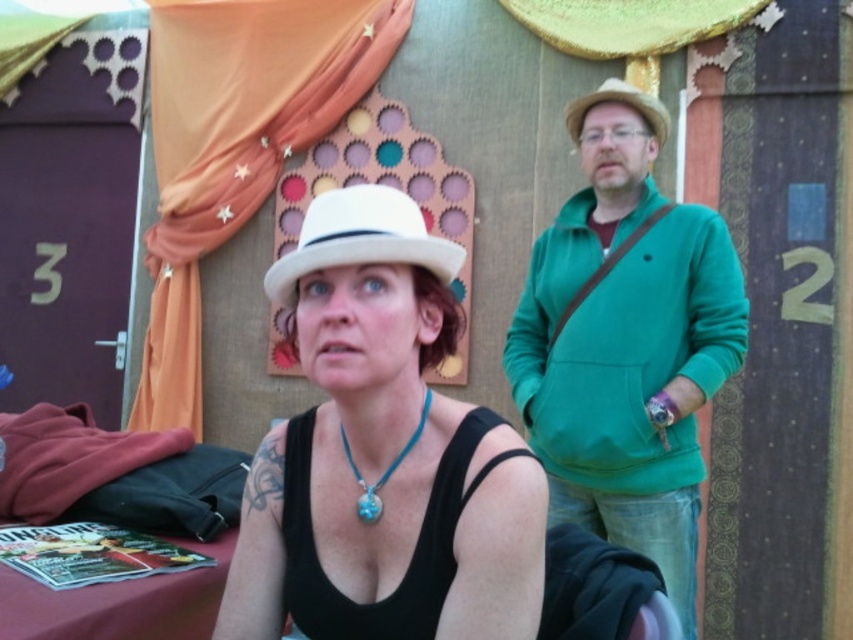
You are a photographer trying to capture both the matte white hat at center and the turquoise stone pendant at center in a single frame. Based on their positions, which object would appear closer to the camera?

The matte white hat at center is in front of the turquoise stone pendant at center, so it would appear closer to the camera.